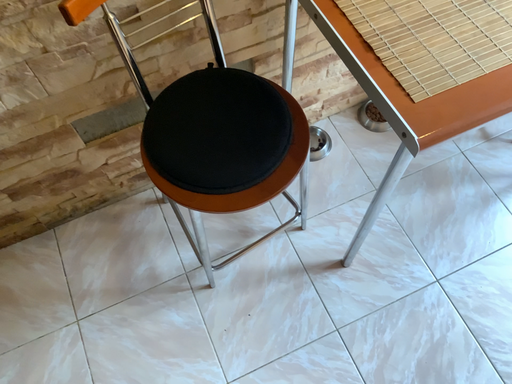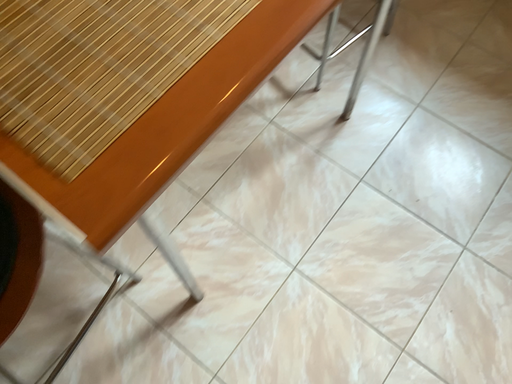
Question: Which way did the camera rotate in the video?

Choices:
 (A) rotated left
 (B) rotated right

Answer: (B)